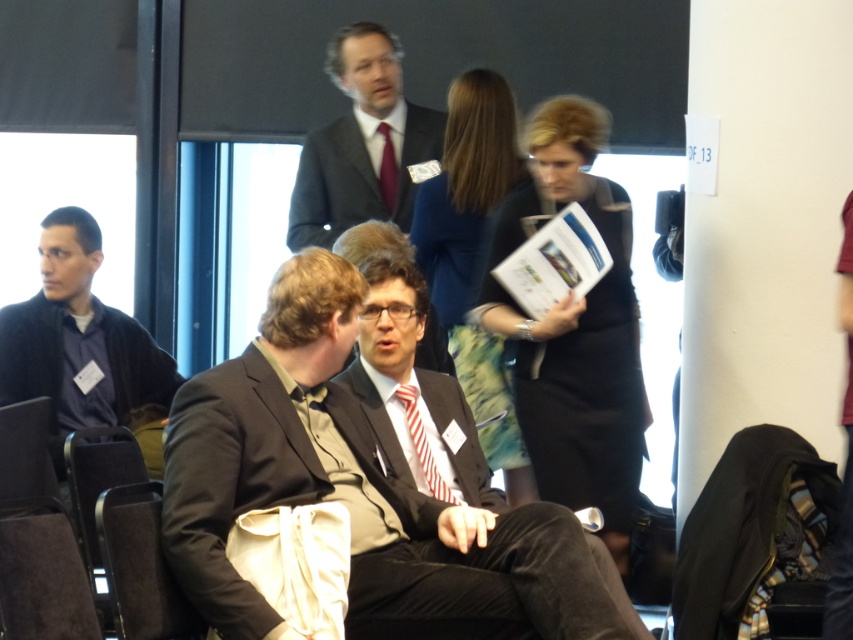
Question: Estimate the real-world distances between objects in this image. Which object is closer to the matte black suit at upper center?

Choices:
 (A) matte black suit at center
 (B) dark gray sweater at left
 (C) dark brown leather chair at lower left

Answer: (B)

Question: Does matte black suit at upper center have a lesser width compared to dark brown leather chair at lower left?

Choices:
 (A) no
 (B) yes

Answer: (A)

Question: Is matte black suit at center below matte red tie at center?

Choices:
 (A) no
 (B) yes

Answer: (B)

Question: Which of the following is the closest to the observer?

Choices:
 (A) (405, 524)
 (B) (318, 241)

Answer: (A)

Question: Which point is farther from the camera taking this photo?

Choices:
 (A) (416, 452)
 (B) (7, 589)
 (C) (636, 616)

Answer: (A)

Question: Considering the relative positions of dark brown leather chair at lower left and red striped tie at center in the image provided, where is dark brown leather chair at lower left located with respect to red striped tie at center?

Choices:
 (A) left
 (B) right

Answer: (A)